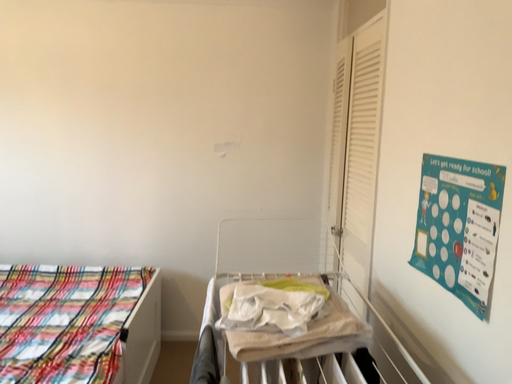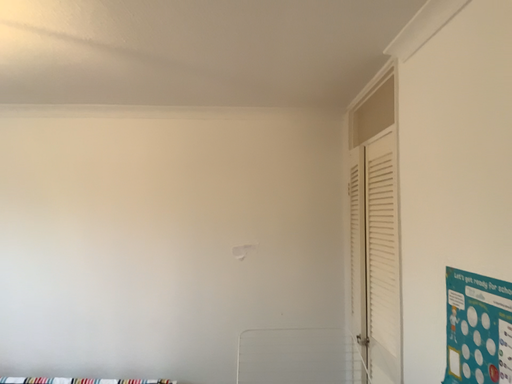
Question: Which way did the camera rotate in the video?

Choices:
 (A) rotated upward
 (B) rotated downward

Answer: (A)